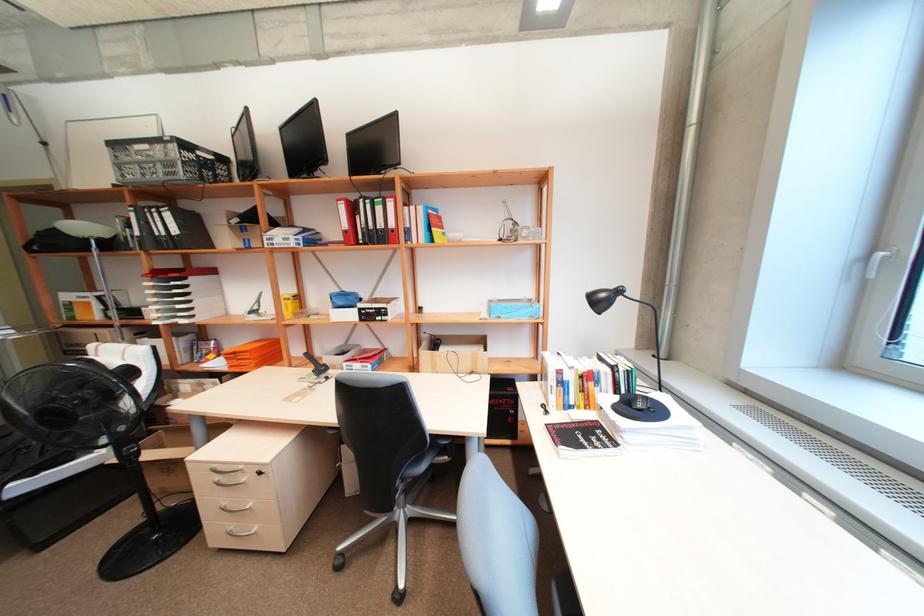
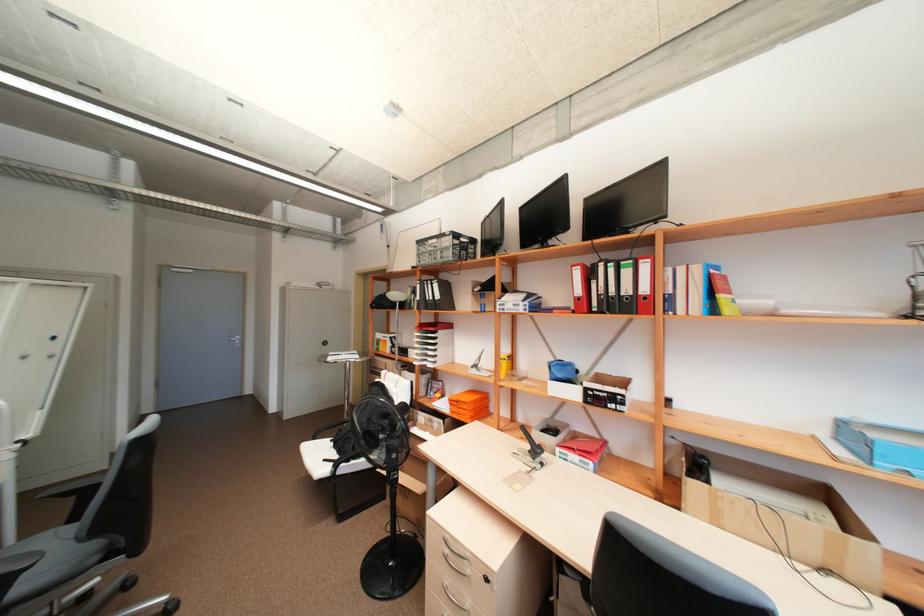
Find the pixel in the second image that matches pixel 361 360 in the first image.

(578, 448)